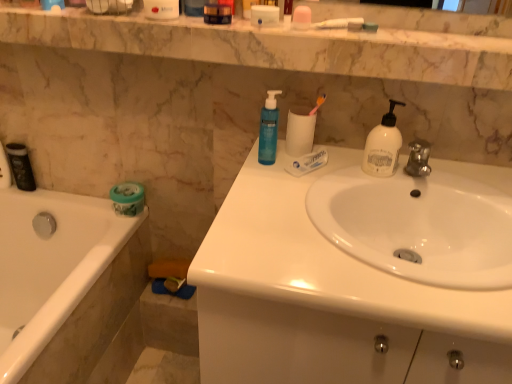
This screenshot has width=512, height=384. Find the location of `vacant space in front of green matte jar at lower left, the 1th toilet paper viewed from the left`. vacant space in front of green matte jar at lower left, the 1th toilet paper viewed from the left is located at coordinates (113, 236).